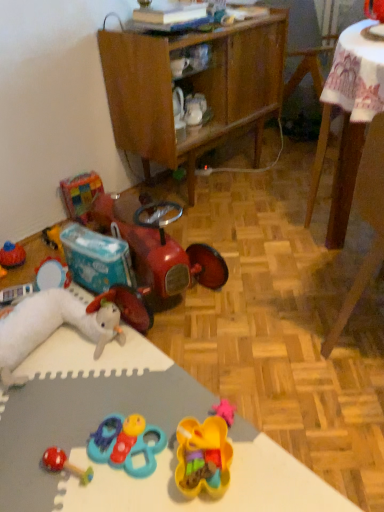
The image size is (384, 512). Find the location of `free space that is in between teal plastic toy at center, which appears as the fourth toy when viewed from the left, and white plush rabbit at lower left, the 1th toy from the left`. free space that is in between teal plastic toy at center, which appears as the fourth toy when viewed from the left, and white plush rabbit at lower left, the 1th toy from the left is located at coordinates (100, 394).